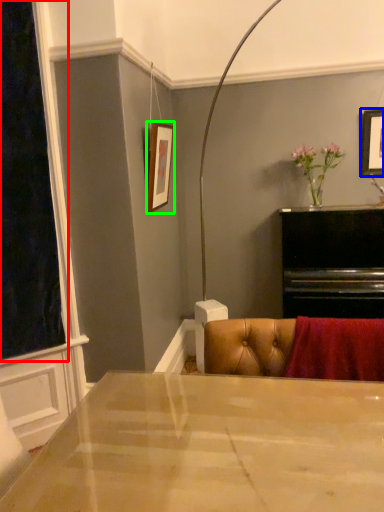
Question: Which object is the closest to the window screen (highlighted by a red box)? Choose among these: picture frame (highlighted by a blue box) or picture frame (highlighted by a green box).

Choices:
 (A) picture frame
 (B) picture frame

Answer: (B)